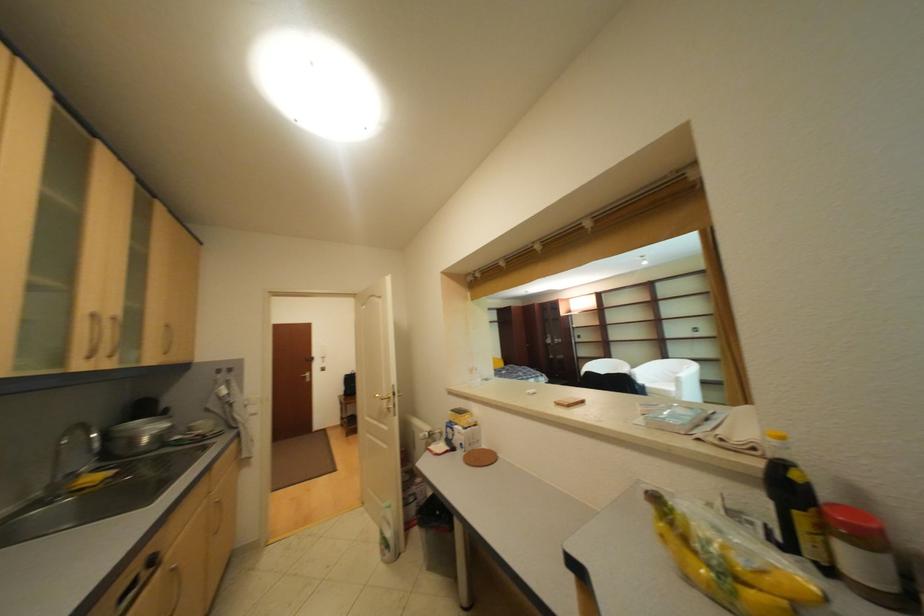
Where would you lift the jar with red lid? Please return your answer as a coordinate pair (x, y).

(862, 554)